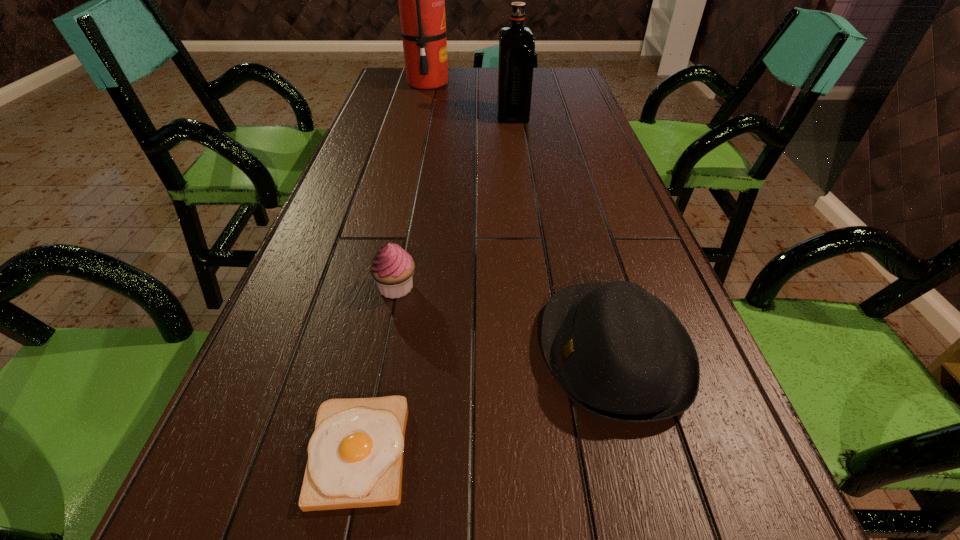
Locate an element on the screen. The height and width of the screenshot is (540, 960). free spot located 0.250m on the front label of the liquor is located at coordinates (421, 116).

Locate an element on the screen. This screenshot has width=960, height=540. free space located on the front-facing side of the fedora is located at coordinates (351, 352).

Where is `free space located on the front-facing side of the fedora`? The image size is (960, 540). free space located on the front-facing side of the fedora is located at coordinates (505, 352).

The image size is (960, 540). Find the location of `free space located on the front-facing side of the fedora`. free space located on the front-facing side of the fedora is located at coordinates (422, 352).

Find the location of a particular element. This screenshot has height=540, width=960. vacant space positioned on the front of the cupcake is located at coordinates (372, 408).

This screenshot has height=540, width=960. In order to click on free space located on the back of the toast in this screenshot , I will do `click(385, 322)`.

I want to click on object present at the far edge, so click(421, 0).

Locate an element on the screen. fire extinguisher at the left edge is located at coordinates (421, 0).

I want to click on toast that is positioned at the left edge, so click(355, 455).

Where is `object located at the right edge`? This screenshot has width=960, height=540. object located at the right edge is located at coordinates [x=618, y=352].